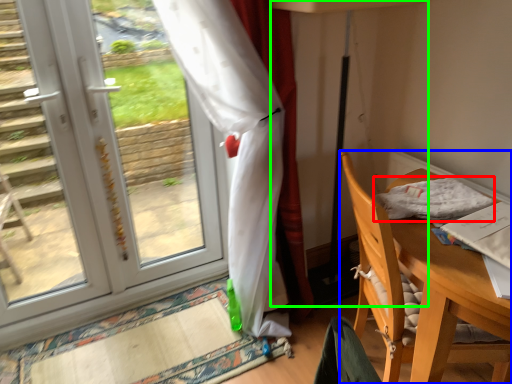
Question: Which object is the farthest from cloth (highlighted by a red box)? Choose among these: chair (highlighted by a blue box) or table lamp (highlighted by a green box).

Choices:
 (A) chair
 (B) table lamp

Answer: (B)